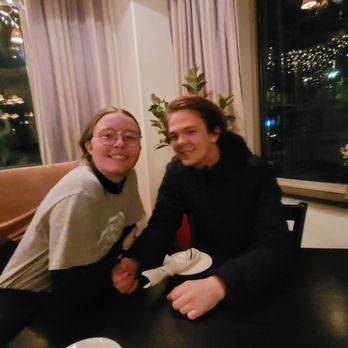
Locate an element on the screen. round white plate is located at coordinates [x=205, y=268].